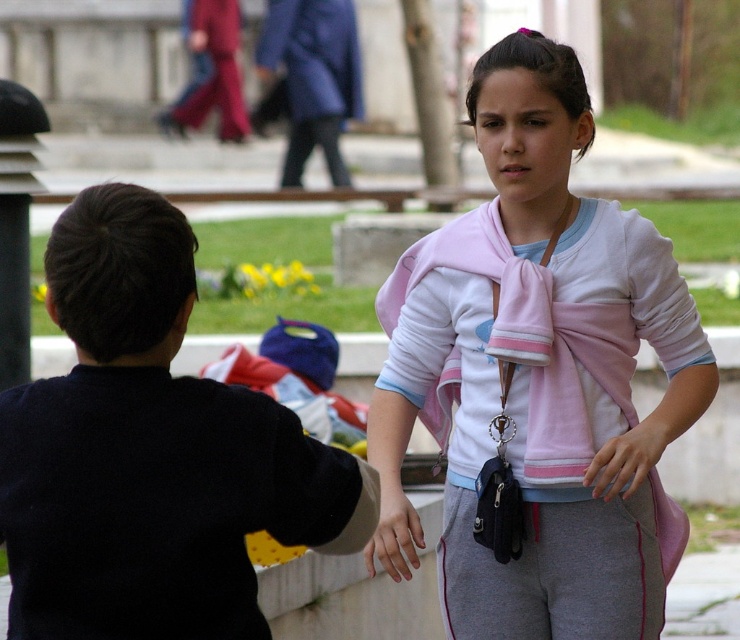
Question: Does pink fabric scarf at center have a lesser width compared to black matte sweater at left?

Choices:
 (A) yes
 (B) no

Answer: (B)

Question: Does black matte sweater at left appear under gray cotton leggings at lower center?

Choices:
 (A) yes
 (B) no

Answer: (B)

Question: Based on their relative distances, which object is farther from the smooth skin hand at center?

Choices:
 (A) pink fleece sweatshirt at center
 (B) pink fabric scarf at center
 (C) gray cotton leggings at lower center
 (D) blue cotton sweatshirt at upper center

Answer: (D)

Question: Among these points, which one is nearest to the camera?

Choices:
 (A) (417, 291)
 (B) (110, 625)

Answer: (B)

Question: Does blue cotton sweatshirt at upper center appear under smooth skin hand at center?

Choices:
 (A) yes
 (B) no

Answer: (B)

Question: Which point appears closest to the camera in this image?

Choices:
 (A) (588, 529)
 (B) (619, 300)
 (C) (420, 541)

Answer: (C)